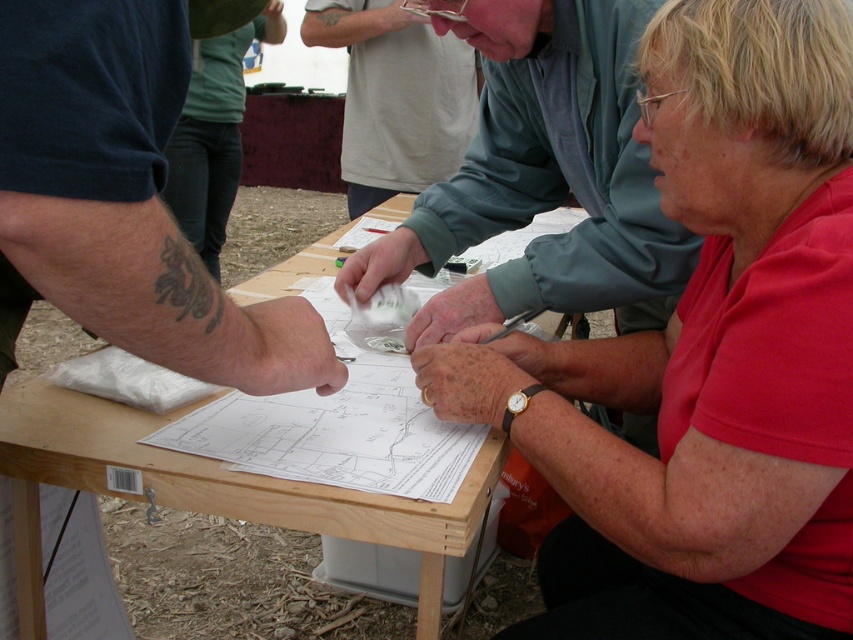
Question: Among these objects, which one is farthest from the camera?

Choices:
 (A) gray matte shirt at upper center
 (B) red matte shirt at center

Answer: (A)

Question: Which point is farther to the camera?

Choices:
 (A) red matte shirt at center
 (B) matte green shirt at upper center
 (C) jeans at center
 (D) gray matte shirt at upper center

Answer: (C)

Question: Where is wooden table at center located in relation to jeans at center in the image?

Choices:
 (A) below
 (B) above

Answer: (A)

Question: Is matte green shirt at upper center closer to the viewer compared to jeans at center?

Choices:
 (A) no
 (B) yes

Answer: (B)

Question: Is matte green shirt at upper center below gray matte shirt at upper center?

Choices:
 (A) yes
 (B) no

Answer: (A)

Question: Which of the following is the farthest from the observer?

Choices:
 (A) matte green shirt at upper center
 (B) gray matte shirt at upper center

Answer: (B)